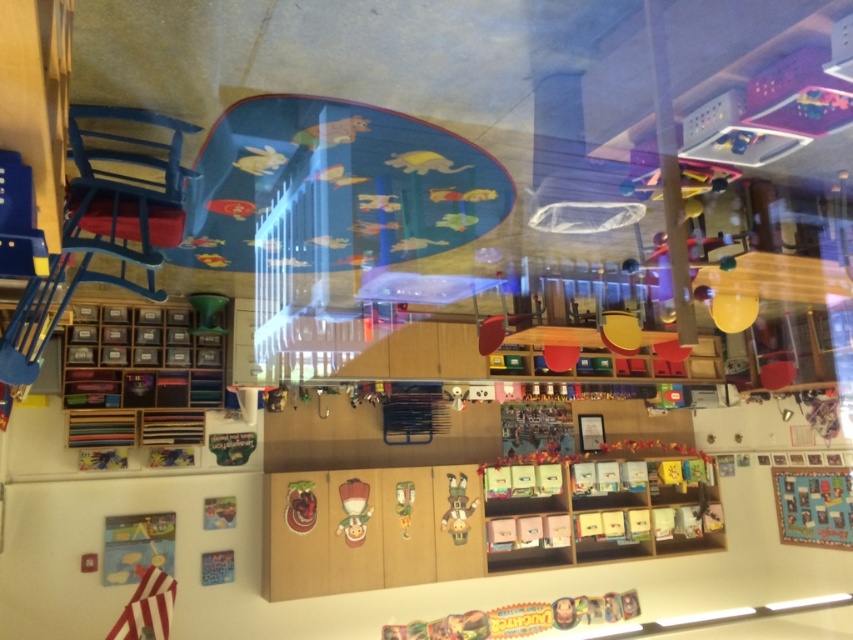
Is textured fabric quilt at lower right to the left of matte plastic clown at center from the viewer's perspective?

No, textured fabric quilt at lower right is not to the left of matte plastic clown at center.

Is point (833, 528) closer to viewer compared to point (364, 513)?

No.

This screenshot has width=853, height=640. Find the location of `textured fabric quilt at lower right`. textured fabric quilt at lower right is located at coordinates coord(813,506).

The height and width of the screenshot is (640, 853). Identify the location of textured fabric quilt at lower right. (813, 506).

Does matte plastic clown at center appear over green plastic toy at center?

Yes.

Consider the image. Between matte plastic clown at center and green plastic toy at center, which one has less height?

green plastic toy at center

Measure the distance between matte plastic clown at center and camera.

The distance of matte plastic clown at center from camera is 4.73 meters.

Find the location of a particular element. The width and height of the screenshot is (853, 640). matte plastic clown at center is located at coordinates (354, 509).

Can you confirm if wooden clown at center is positioned to the right of green plastic toy at center?

Correct, you'll find wooden clown at center to the right of green plastic toy at center.

Which of these two, wooden clown at center or green plastic toy at center, stands taller?

With more height is wooden clown at center.

Where is `wooden clown at center`? Image resolution: width=853 pixels, height=640 pixels. wooden clown at center is located at coordinates (457, 508).

Locate an element on the screen. This screenshot has width=853, height=640. wooden clown at center is located at coordinates (457, 508).